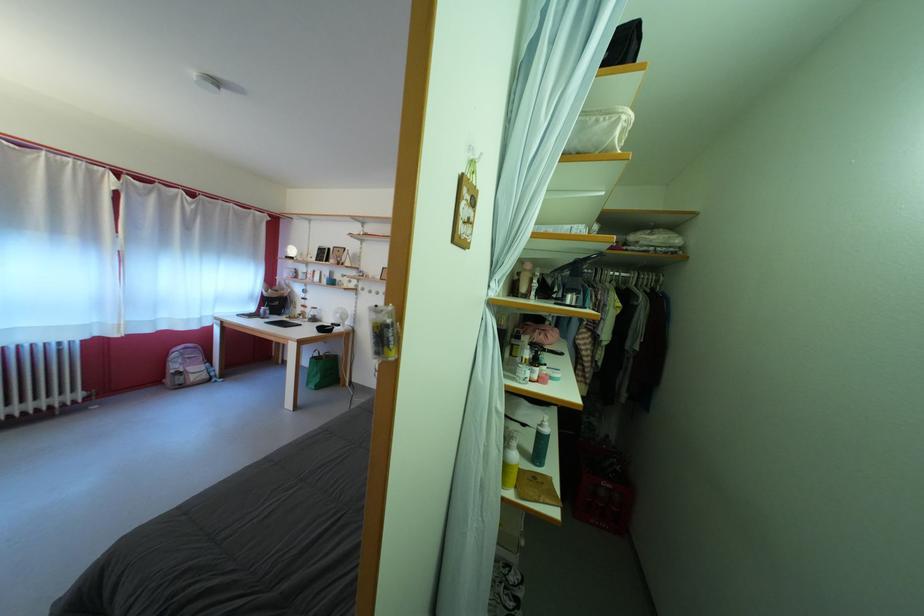
Find where to lift the green bag handle. Please return your answer as a coordinate pair (x, y).

(319, 353)